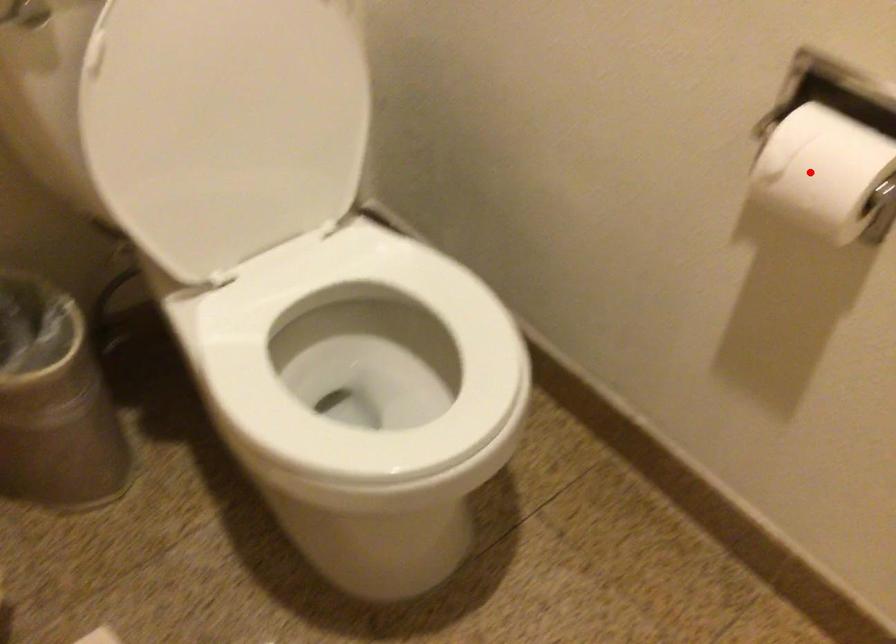
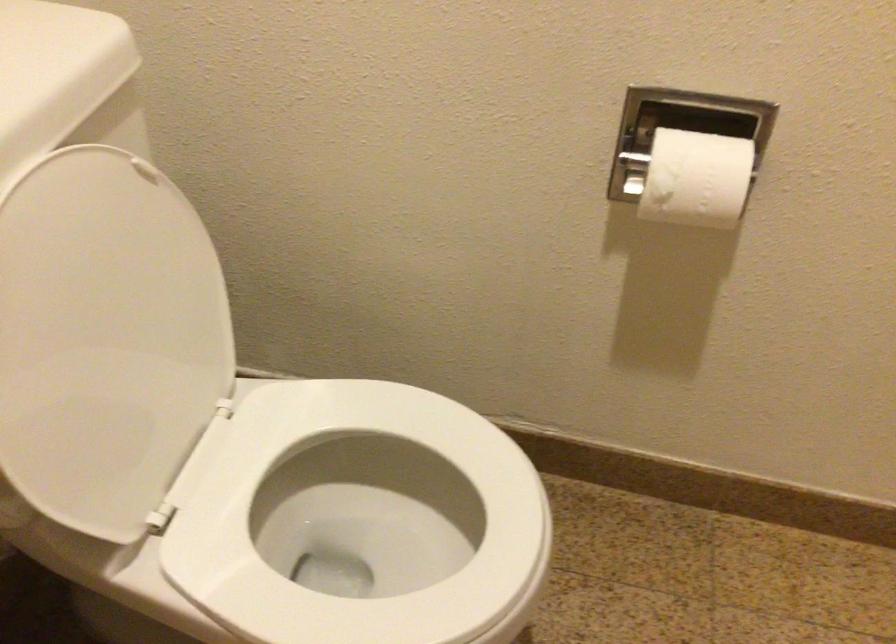
Where in the second image is the point corresponding to the highlighted location from the first image?

(695, 178)